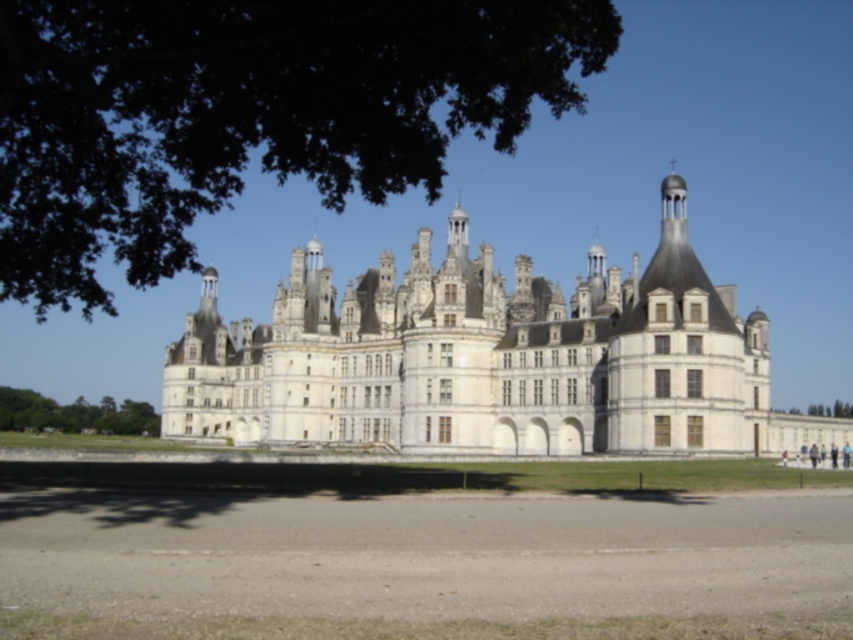
Question: Which point is farther to the camera?

Choices:
 (A) green leafy tree at lower left
 (B) dark green leafy tree at upper left
 (C) white stone castle at center

Answer: (A)

Question: Does dark green leafy tree at upper left have a smaller size compared to green leafy tree at lower left?

Choices:
 (A) yes
 (B) no

Answer: (B)

Question: Does dark green leafy tree at upper left have a smaller size compared to white stone castle at center?

Choices:
 (A) no
 (B) yes

Answer: (A)

Question: Estimate the real-world distances between objects in this image. Which object is closer to the green leafy tree at lower left?

Choices:
 (A) dark green leafy tree at upper left
 (B) white stone castle at center

Answer: (B)

Question: Is dark green leafy tree at upper left wider than green leafy tree at lower left?

Choices:
 (A) yes
 (B) no

Answer: (A)

Question: Which object is farther from the camera taking this photo?

Choices:
 (A) white stone castle at center
 (B) green leafy tree at lower left
 (C) dark green leafy tree at upper left

Answer: (B)